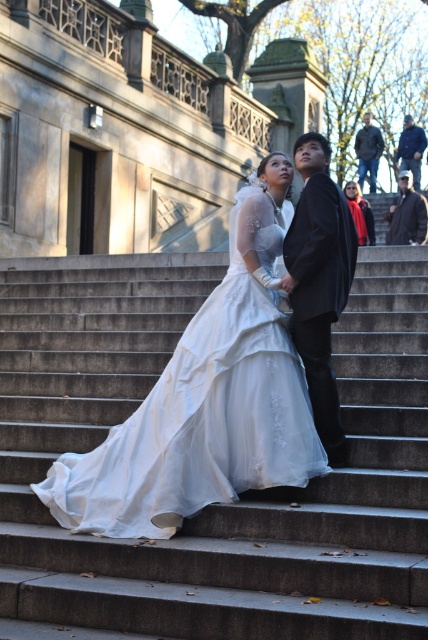
You are a photographer at the wedding and need to adjust the lighting to ensure both the white satin dress at center and the denim jacket at upper right are well illuminated. Given their sizes, which one might require more focused lighting to highlight its details?

The white satin dress at center has a smaller size compared to the denim jacket at upper right, so it might require more focused lighting to highlight its details since it is smaller and may need closer attention to capture its intricate designs.

You are a photographer at the wedding and want to position your camera exactly at the center of the white satin dress at center. What are the coordinates you should aim for?

The coordinates for the white satin dress at center are at point (204, 410), so you should aim your camera at those coordinates to center it.